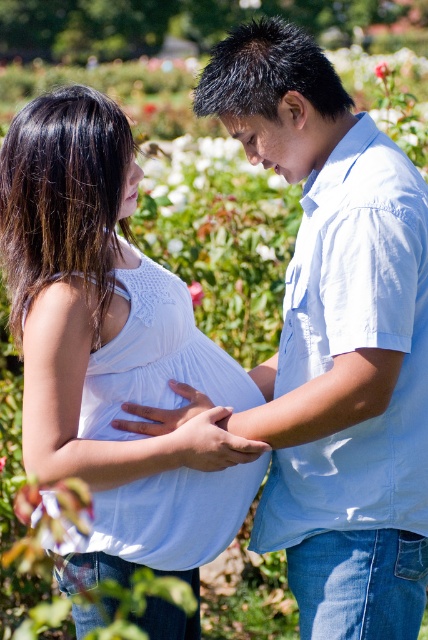
Can you confirm if smooth skin hand at center is wider than matte skin hand at center?

Yes, smooth skin hand at center is wider than matte skin hand at center.

Does point (211, 445) come in front of point (163, 433)?

Yes, it is.

Is point (172, 429) positioned before point (187, 388)?

Yes, it is in front of point (187, 388).

Identify the location of smooth skin hand at center. (210, 444).

Does light blue cotton shirt at center have a lesser height compared to pink matte rose at upper center?

Yes.

Based on the photo, can you confirm if light blue cotton shirt at center is taller than pink matte rose at upper center?

In fact, light blue cotton shirt at center may be shorter than pink matte rose at upper center.

Locate an element on the screen. light blue cotton shirt at center is located at coordinates (338, 340).

Where is `light blue cotton shirt at center`? light blue cotton shirt at center is located at coordinates (338, 340).

Is smooth skin hand at center shorter than pink matte rose at upper center?

Indeed, smooth skin hand at center has a lesser height compared to pink matte rose at upper center.

I want to click on smooth skin hand at center, so click(x=210, y=444).